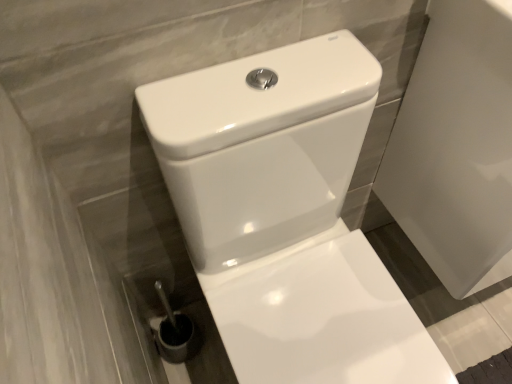
Measure the distance between white glossy porcelain at right and camera.

white glossy porcelain at right is 22.91 inches away from camera.

Locate an element on the screen. The image size is (512, 384). white glossy porcelain at right is located at coordinates (456, 144).

What do you see at coordinates (456, 144) in the screenshot? I see `white glossy porcelain at right` at bounding box center [456, 144].

What do you see at coordinates (286, 215) in the screenshot? This screenshot has width=512, height=384. I see `white glossy toilet at center` at bounding box center [286, 215].

Locate an element on the screen. Image resolution: width=512 pixels, height=384 pixels. white glossy toilet at center is located at coordinates (286, 215).

The height and width of the screenshot is (384, 512). I want to click on white glossy porcelain at right, so click(x=456, y=144).

Which object is positioned more to the right, white glossy porcelain at right or white glossy toilet at center?

Positioned to the right is white glossy porcelain at right.

Is white glossy porcelain at right positioned in front of white glossy toilet at center?

No, the depth of white glossy porcelain at right is greater than that of white glossy toilet at center.

Is point (475, 129) positioned after point (339, 244)?

That is False.

From the image's perspective, is white glossy porcelain at right on white glossy toilet at center?

Indeed, from the image's perspective, white glossy porcelain at right is shown above white glossy toilet at center.

From a real-world perspective, is white glossy porcelain at right physically below white glossy toilet at center?

No, from a real-world perspective, white glossy porcelain at right is not below white glossy toilet at center.

In terms of width, does white glossy porcelain at right look wider or thinner when compared to white glossy toilet at center?

white glossy porcelain at right is thinner than white glossy toilet at center.

Based on the photo, which of these two, white glossy porcelain at right or white glossy toilet at center, stands taller?

With more height is white glossy toilet at center.

Can you confirm if white glossy porcelain at right is bigger than white glossy toilet at center?

No.

Would you say white glossy porcelain at right is inside or outside white glossy toilet at center?

The correct answer is: outside.

Is white glossy porcelain at right far from white glossy toilet at center?

That's not correct — white glossy porcelain at right is a little close to white glossy toilet at center.

Is white glossy porcelain at right aimed at white glossy toilet at center?

No, white glossy porcelain at right is not facing towards white glossy toilet at center.

I want to click on porcelain on the right of white glossy toilet at center, so click(x=456, y=144).

Is white glossy toilet at center at the right side of white glossy porcelain at right?

Incorrect, white glossy toilet at center is not on the right side of white glossy porcelain at right.

Is the position of white glossy toilet at center less distant than that of white glossy porcelain at right?

Yes.

Is point (267, 367) closer or farther from the camera than point (467, 79)?

Point (267, 367) is positioned farther from the camera compared to point (467, 79).

From the image's perspective, between white glossy toilet at center and white glossy porcelain at right, which one is located above?

white glossy porcelain at right.

From a real-world perspective, is white glossy toilet at center under white glossy porcelain at right?

Yes, from a real-world perspective, white glossy toilet at center is below white glossy porcelain at right.

Which object is thinner, white glossy toilet at center or white glossy porcelain at right?

white glossy porcelain at right.

Between white glossy toilet at center and white glossy porcelain at right, which one has more height?

white glossy toilet at center is taller.

Between white glossy toilet at center and white glossy porcelain at right, which one has larger size?

white glossy toilet at center is bigger.

Is white glossy toilet at center outside of white glossy porcelain at right?

Indeed, white glossy toilet at center is completely outside white glossy porcelain at right.

Is white glossy toilet at center far away from white glossy porcelain at right?

white glossy toilet at center is near white glossy porcelain at right, not far away.

Could you tell me if white glossy toilet at center is turned towards white glossy porcelain at right?

No.

Locate an element on the screen. This screenshot has height=384, width=512. toilet below the white glossy porcelain at right (from the image's perspective) is located at coordinates (286, 215).

Identify the location of porcelain above the white glossy toilet at center (from the image's perspective). (456, 144).

Locate an element on the screen. This screenshot has height=384, width=512. toilet below the white glossy porcelain at right (from the image's perspective) is located at coordinates (286, 215).